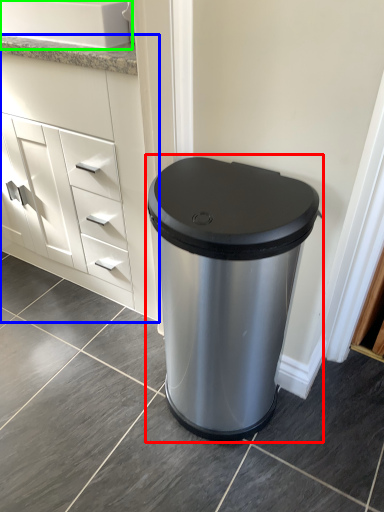
Question: Considering the real-world distances, which object is closest to waste container (highlighted by a red box)? chest of drawers (highlighted by a blue box) or sink (highlighted by a green box).

Choices:
 (A) chest of drawers
 (B) sink

Answer: (A)